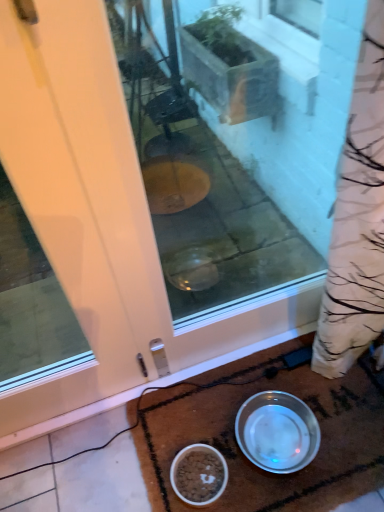
I want to click on free space in front of silver metallic bowl at lower center, arranged as the 1th bowl when viewed from the right, so click(x=295, y=494).